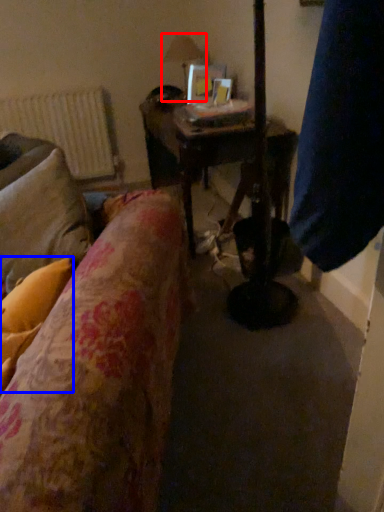
Question: Which of the following is the closest to the observer, table lamp (highlighted by a red box) or pillow (highlighted by a blue box)?

Choices:
 (A) table lamp
 (B) pillow

Answer: (B)